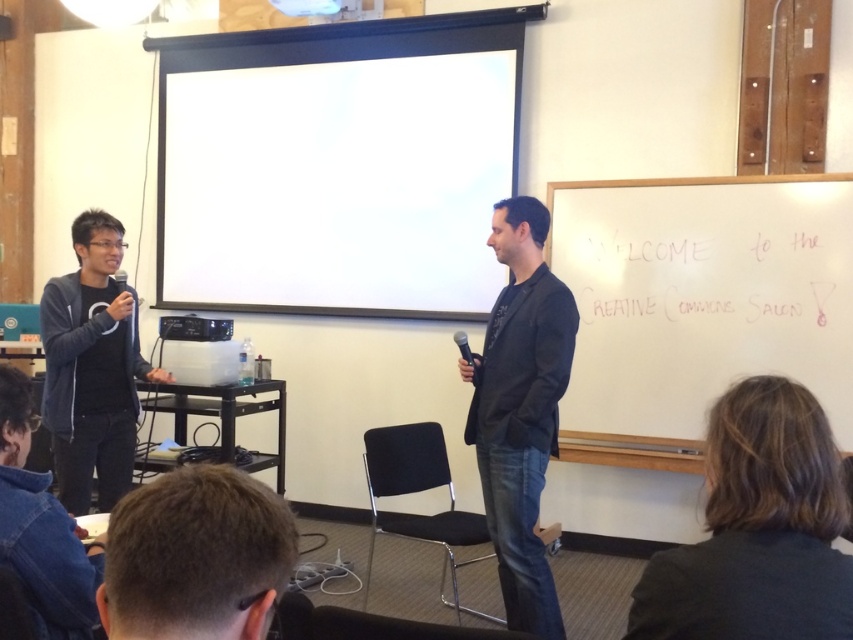
You are standing at the front of the classroom and want to move from the point marked as point (x=134, y=624) to the point marked as point (x=459, y=340). Which direction should you move to get closer to your destination?

You should move backward because point (x=134, y=624) is in front of point (x=459, y=340), so moving backward will bring you closer to the destination.

You are standing in the classroom and want to reach the point at coordinates (119, 595). If your arm can reach 30 inches, can you touch that point without moving your feet?

The point at coordinates (119, 595) is 31.81 inches away from you, which is beyond your arm reach of 30 inches. You cannot touch it without moving your feet.

You are standing in the classroom and want to locate the projector. Where is the black plastic projector at center located relative to the point at coordinates (194, 328)?

The point at coordinates (194, 328) is on the black plastic projector at center, so the projector is located exactly at that point.